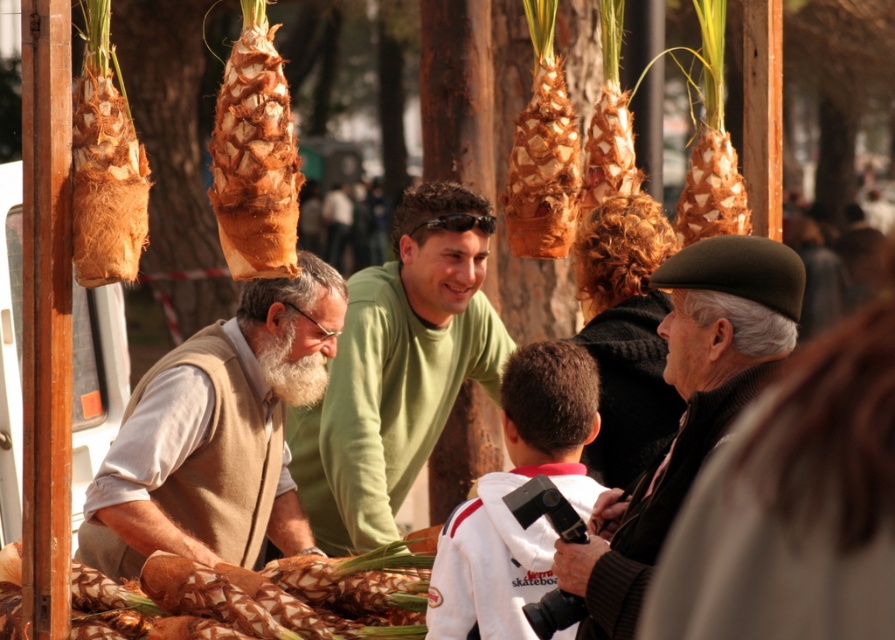
Question: Among these points, which one is farthest from the camera?

Choices:
 (A) (18, 634)
 (B) (448, 358)
 (C) (597, 596)
 (D) (305, 259)

Answer: (B)

Question: Can you confirm if beige wool vest at left is positioned above brown textured pineapple at center?

Choices:
 (A) yes
 (B) no

Answer: (A)

Question: Can you confirm if green matte sweater at center is positioned to the right of brown textured pineapple at center?

Choices:
 (A) no
 (B) yes

Answer: (B)

Question: Among these objects, which one is farthest from the camera?

Choices:
 (A) green matte sweater at center
 (B) brown textured pineapple at center
 (C) white fleece jacket at center
 (D) beige wool vest at left

Answer: (A)

Question: Among these objects, which one is nearest to the camera?

Choices:
 (A) green matte sweater at center
 (B) brown papery onion at upper center

Answer: (B)

Question: Does beige wool vest at left appear under green matte sweater at center?

Choices:
 (A) no
 (B) yes

Answer: (B)